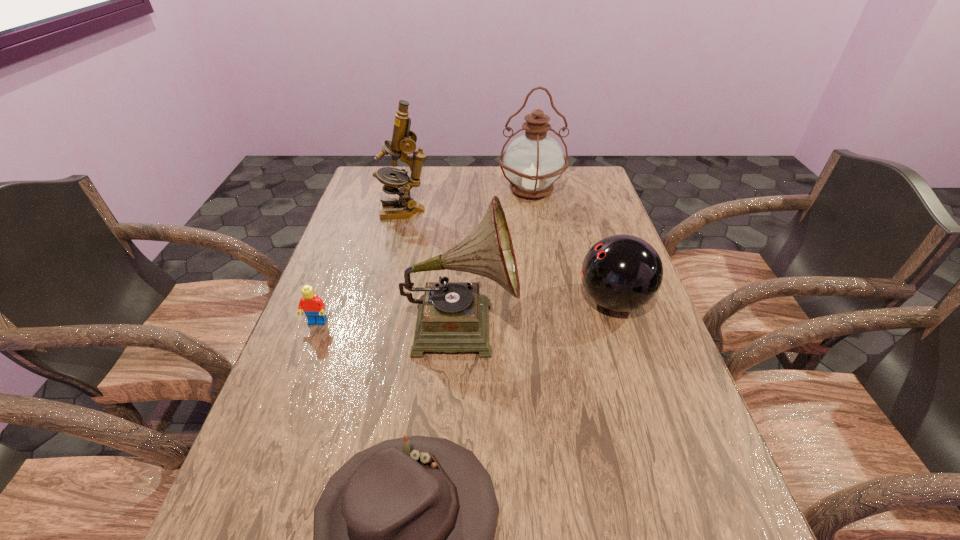
At what (x,y) coordinates should I click in order to perform the action: click on free space located 0.140m on the surface of the fourth tallest object near the finger holes. Please return your answer as a coordinate pair (x, y). This screenshot has height=540, width=960. Looking at the image, I should click on (522, 301).

You are a GUI agent. You are given a task and a screenshot of the screen. Output one action in this format:
    pyautogui.click(x=<x>, y=<y>)
    Task: Click on the vacant area situated on the face of the leftmost object
    This screenshot has height=540, width=960.
    Given the screenshot: What is the action you would take?
    pyautogui.click(x=264, y=463)

This screenshot has height=540, width=960. I want to click on object that is at the far edge, so click(x=534, y=161).

The width and height of the screenshot is (960, 540). I want to click on microscope at the left edge, so click(x=404, y=140).

Image resolution: width=960 pixels, height=540 pixels. I want to click on Lego that is at the left edge, so click(x=313, y=306).

Where is `oil lamp present at the right edge`? oil lamp present at the right edge is located at coordinates (534, 161).

Find the location of `bowling ball situated at the right edge`. bowling ball situated at the right edge is located at coordinates (621, 273).

Locate an element on the screen. Image resolution: width=960 pixels, height=540 pixels. object at the far right corner is located at coordinates (534, 161).

What are the coordinates of `vacant area at the left edge of the desktop` in the screenshot? It's located at (355, 203).

Identify the location of free space at the right edge of the desktop. The image size is (960, 540). (594, 241).